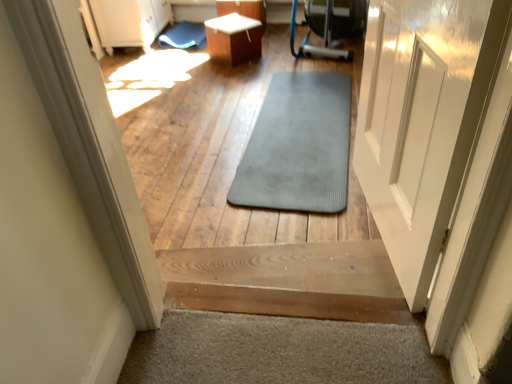
Question: Is wooden stairs at center at the right side of blue rubber mat at upper center, acting as the 1th mat starting from the left?

Choices:
 (A) yes
 (B) no

Answer: (A)

Question: Is wooden stairs at center aimed at blue rubber mat at upper center, the second mat in the front-to-back sequence?

Choices:
 (A) yes
 (B) no

Answer: (A)

Question: From a real-world perspective, is wooden stairs at center under blue rubber mat at upper center, the 1th mat from the top?

Choices:
 (A) yes
 (B) no

Answer: (B)

Question: From the image's perspective, is wooden stairs at center over blue rubber mat at upper center, which is the 1th mat from back to front?

Choices:
 (A) yes
 (B) no

Answer: (B)

Question: From a real-world perspective, is wooden stairs at center over blue rubber mat at upper center, which is counted as the second mat, starting from the right?

Choices:
 (A) yes
 (B) no

Answer: (A)

Question: Based on their sizes in the image, would you say white glossy table at center is bigger or smaller than wooden stairs at center?

Choices:
 (A) small
 (B) big

Answer: (A)

Question: From the image's perspective, is white glossy table at center above or below wooden stairs at center?

Choices:
 (A) above
 (B) below

Answer: (A)

Question: Is point (260, 26) positioned closer to the camera than point (307, 279)?

Choices:
 (A) closer
 (B) farther

Answer: (B)

Question: Is white glossy table at center in front of or behind wooden stairs at center in the image?

Choices:
 (A) behind
 (B) front

Answer: (A)

Question: Is point (273, 124) positioned closer to the camera than point (301, 286)?

Choices:
 (A) farther
 (B) closer

Answer: (A)

Question: Would you say gray rubber mat at center, positioned as the first mat in bottom-to-top order, is inside or outside gray rubber mat at center?

Choices:
 (A) outside
 (B) inside

Answer: (A)

Question: Considering the positions of gray rubber mat at center, which is the first mat from front to back, and gray rubber mat at center in the image, is gray rubber mat at center, which is the first mat from front to back, taller or shorter than gray rubber mat at center?

Choices:
 (A) short
 (B) tall

Answer: (A)

Question: Is gray rubber mat at center, which ranks as the 2th mat in left-to-right order, bigger or smaller than gray rubber mat at center?

Choices:
 (A) big
 (B) small

Answer: (B)

Question: From the image's perspective, is white glossy table at center above or below gray rubber mat at center?

Choices:
 (A) above
 (B) below

Answer: (A)

Question: In the image, is white glossy table at center on the left side or the right side of gray rubber mat at center?

Choices:
 (A) right
 (B) left

Answer: (B)